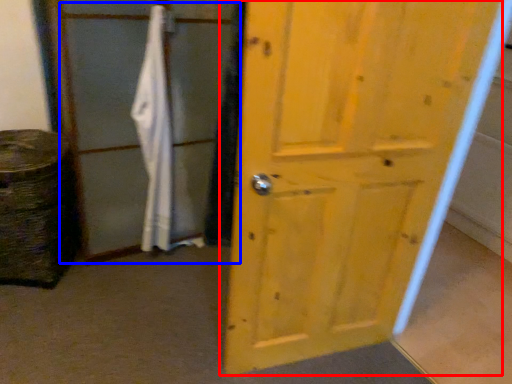
Question: Among these objects, which one is farthest to the camera, door (highlighted by a red box) or screen door (highlighted by a blue box)?

Choices:
 (A) door
 (B) screen door

Answer: (B)